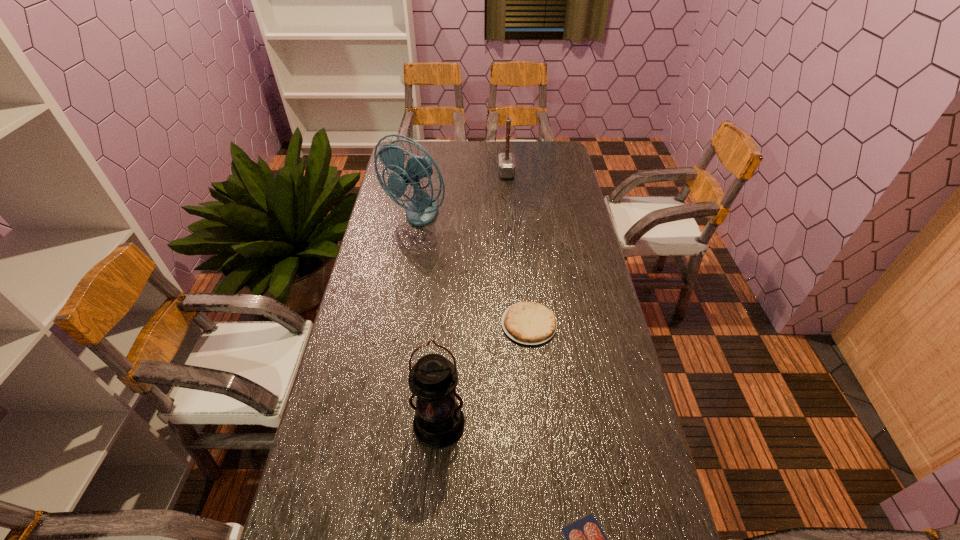
You are a GUI agent. You are given a task and a screenshot of the screen. Output one action in this format:
    pyautogui.click(x=<x>, y=<y>)
    Task: Click on the free space located 0.320m on the striking surface of the farthest object
    This screenshot has height=540, width=960.
    Given the screenshot: What is the action you would take?
    pyautogui.click(x=427, y=173)

Image resolution: width=960 pixels, height=540 pixels. Identify the location of vacant region located 0.320m on the striking surface of the farthest object. (427, 173).

Find the location of a particular element. The width and height of the screenshot is (960, 540). free region located 0.080m on the right of the tortilla is located at coordinates (583, 324).

At what (x,y) coordinates should I click in order to perform the action: click on object that is at the far edge. Please return your answer as a coordinate pair (x, y). Image resolution: width=960 pixels, height=540 pixels. Looking at the image, I should click on (506, 162).

Where is `object that is at the left edge`? object that is at the left edge is located at coordinates (422, 209).

In the image, there is a desktop. Identify the location of vacant space at the far edge. (526, 158).

In the image, there is a desktop. At what (x,y) coordinates should I click in order to perform the action: click on free space at the left edge. Please return your answer as a coordinate pair (x, y). The image size is (960, 540). Looking at the image, I should click on (405, 212).

The width and height of the screenshot is (960, 540). Identify the location of free space at the right edge of the desktop. (554, 204).

The image size is (960, 540). I want to click on vacant point at the far right corner, so click(x=549, y=140).

What are the coordinates of `free space between the hammer and the second tallest object` in the screenshot? It's located at (472, 299).